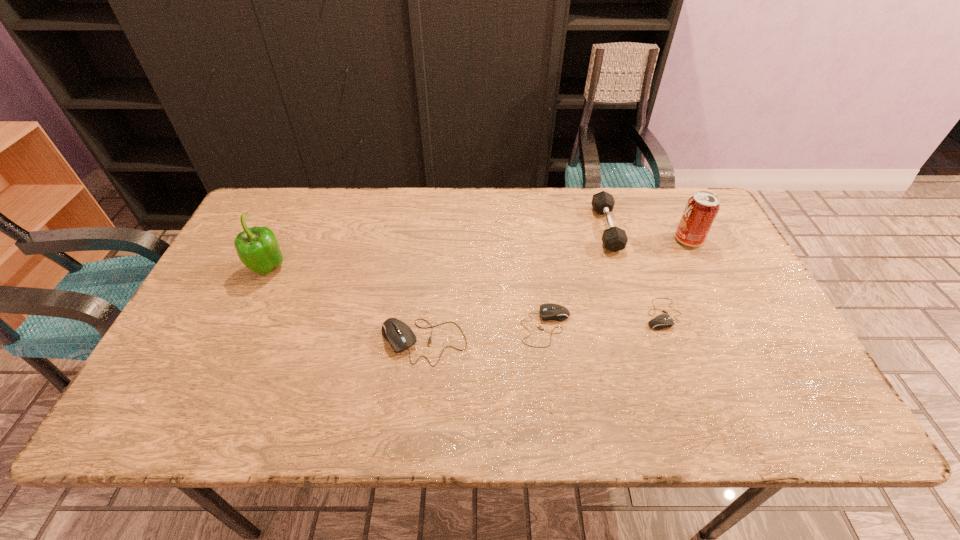
What are the coordinates of `the rightmost object` in the screenshot? It's located at (700, 212).

I want to click on free space located 0.090m on the back of the fifth object from right to left, so click(429, 292).

I want to click on vacant space located 0.090m on the right of the second tallest computer mouse, so click(609, 327).

The height and width of the screenshot is (540, 960). I want to click on free space located 0.120m on the left of the shortest computer mouse, so click(x=596, y=314).

I want to click on free space located on the left of the third tallest object, so click(x=501, y=228).

Locate an element on the screen. This screenshot has width=960, height=540. vacant space positioned on the back of the bell pepper is located at coordinates (300, 204).

Find the location of a particular element. vacant area situated 0.290m on the left of the fifth shortest object is located at coordinates coord(577,240).

Where is `dumbbell that is positioned at the far edge`? The width and height of the screenshot is (960, 540). dumbbell that is positioned at the far edge is located at coordinates (614, 239).

At what (x,y) coordinates should I click in order to perform the action: click on soda can at the far edge. Please return your answer as a coordinate pair (x, y). Looking at the image, I should click on (700, 212).

At what (x,y) coordinates should I click in order to perform the action: click on object located in the near edge section of the desktop. Please return your answer as a coordinate pair (x, y). Looking at the image, I should click on (400, 336).